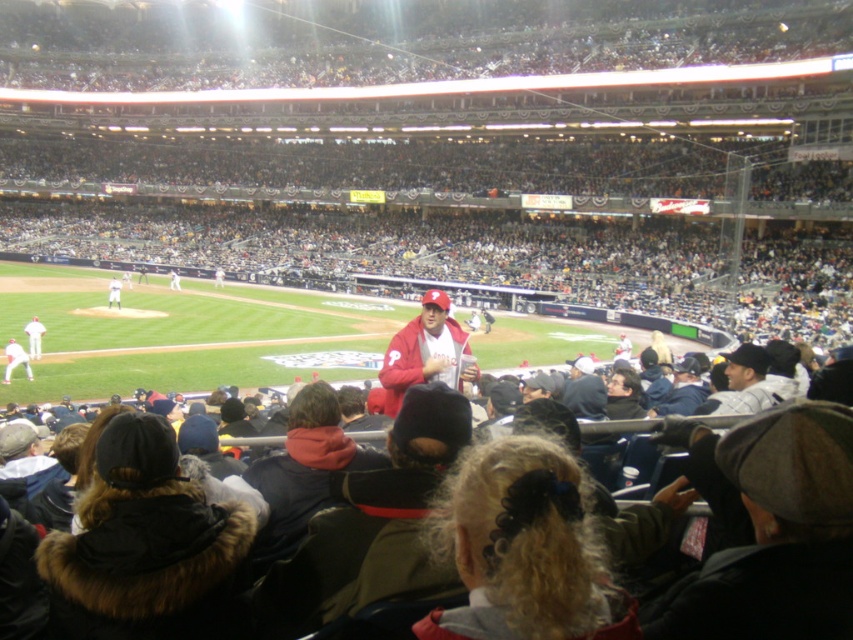
Which is below, white jersey at left or white jersey at center?

Positioned lower is white jersey at left.

Does point (33, 339) come farther from viewer compared to point (119, 288)?

No, (33, 339) is in front of (119, 288).

Where is `white jersey at left`? The height and width of the screenshot is (640, 853). white jersey at left is located at coordinates (33, 337).

Which is more to the right, matte red jacket at center or matte white jersey at lower left?

From the viewer's perspective, matte red jacket at center appears more on the right side.

Does matte red jacket at center have a lesser height compared to matte white jersey at lower left?

Incorrect, matte red jacket at center's height does not fall short of matte white jersey at lower left's.

What do you see at coordinates (426, 353) in the screenshot? This screenshot has width=853, height=640. I see `matte red jacket at center` at bounding box center [426, 353].

Find the location of a particular element. matte red jacket at center is located at coordinates (426, 353).

Which of these two, matte red jacket at center or white jersey at right, stands shorter?

Standing shorter between the two is white jersey at right.

Is point (389, 400) farther from viewer compared to point (740, 410)?

That is True.

Find the location of a particular element. This screenshot has width=853, height=640. matte red jacket at center is located at coordinates (426, 353).